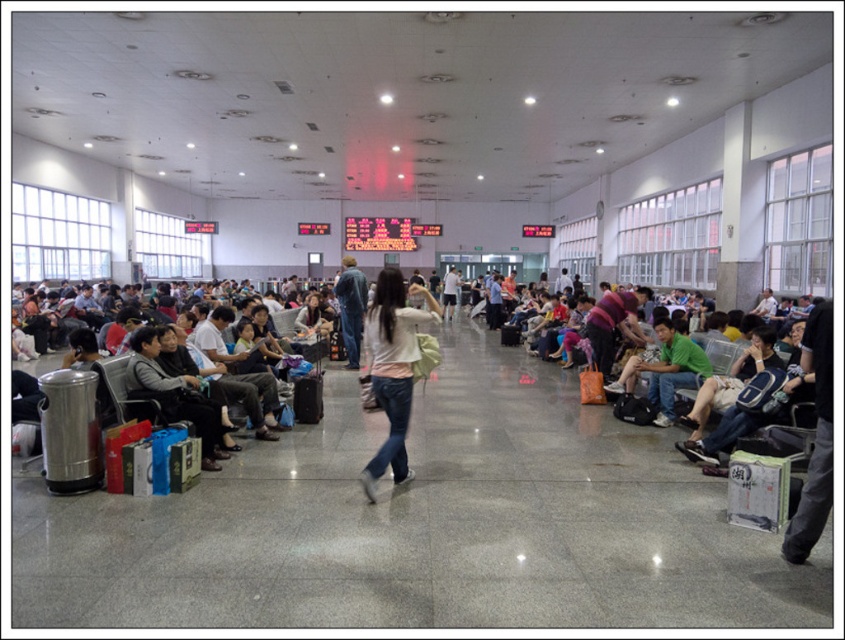
Question: Among these objects, which one is farthest from the camera?

Choices:
 (A) white matte shirt at center
 (B) black fabric suitcase at center

Answer: (B)

Question: Is white matte shirt at center bigger than black fabric suitcase at center?

Choices:
 (A) yes
 (B) no

Answer: (A)

Question: Does white matte shirt at center appear over black fabric suitcase at center?

Choices:
 (A) no
 (B) yes

Answer: (B)

Question: Among these points, which one is nearest to the camera?

Choices:
 (A) pos(315,413)
 (B) pos(377,474)

Answer: (B)

Question: From the image, what is the correct spatial relationship of white matte shirt at center in relation to black fabric suitcase at center?

Choices:
 (A) below
 (B) above

Answer: (B)